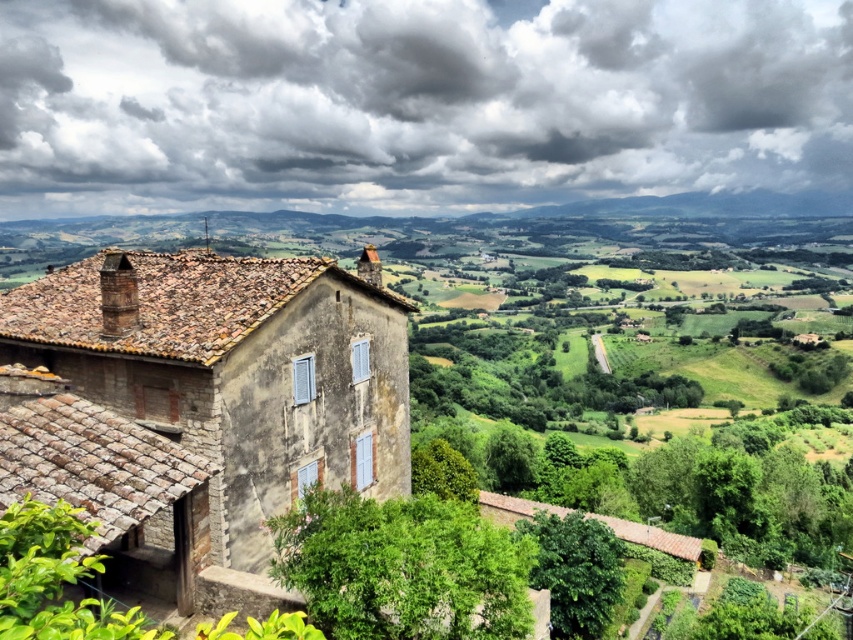
You are an architect analyzing the composition of this rural landscape. Considering the cloudy sky at upper center and the stone house at center, which one spans a greater horizontal distance across the image?

The cloudy sky at upper center spans a greater horizontal distance across the image than the stone house at center because its width surpasses that of the stone house.

You are standing in front of the traditional stone house with a terracotta tiled roof. You want to estimate how far the cloudy sky at upper center is from your current position. Based on the scene, what is the approximate distance in feet?

The cloudy sky at upper center is approximately 1615.53 feet away from the viewer.